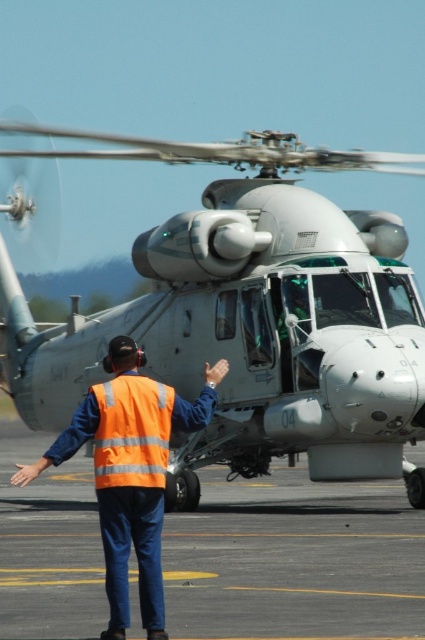
Question: Is gray metallic helicopter at center to the left of gray asphalt tarmac at center from the viewer's perspective?

Choices:
 (A) no
 (B) yes

Answer: (B)

Question: Which is nearer to the gray metallic helicopter at center?

Choices:
 (A) orange reflective vest at center
 (B) gray asphalt tarmac at center

Answer: (A)

Question: Does gray asphalt tarmac at center appear on the right side of orange reflective safety vest at center?

Choices:
 (A) no
 (B) yes

Answer: (B)

Question: Does gray metallic helicopter at center have a lesser width compared to orange reflective vest at center?

Choices:
 (A) no
 (B) yes

Answer: (A)

Question: Which object is positioned farthest from the gray metallic helicopter at center?

Choices:
 (A) gray asphalt tarmac at center
 (B) orange reflective vest at center

Answer: (A)

Question: Among these points, which one is farthest from the camera?

Choices:
 (A) (129, 426)
 (B) (334, 556)
 (C) (190, 492)

Answer: (C)